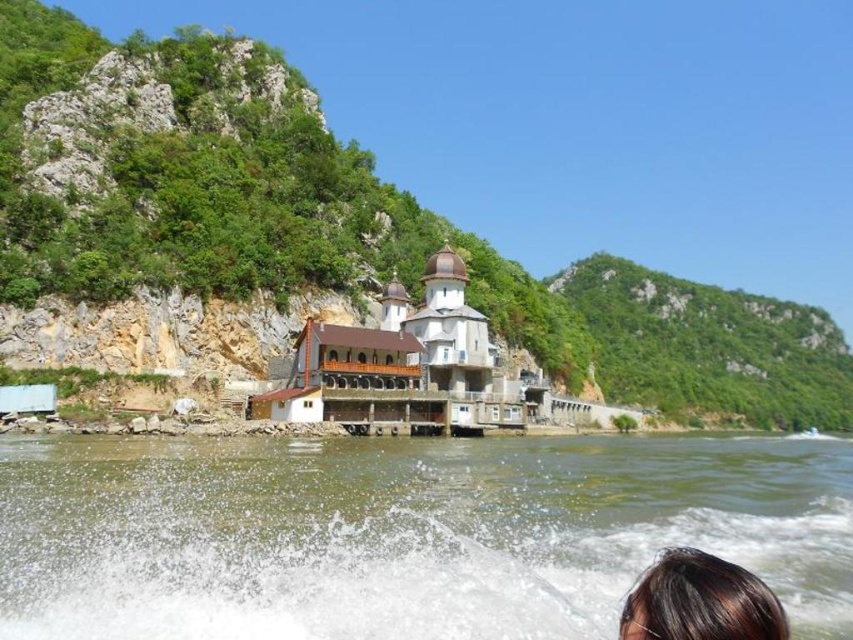
Who is more distant from viewer, (454, 550) or (672, 580)?

Point (454, 550)

In the scene shown: Is brown murky water at lower center behind brown hair at lower right?

Yes, it is behind brown hair at lower right.

Who is more distant from viewer, (813,596) or (647,618)?

Positioned behind is point (813,596).

Where is `brown murky water at lower center`? The height and width of the screenshot is (640, 853). brown murky water at lower center is located at coordinates (405, 532).